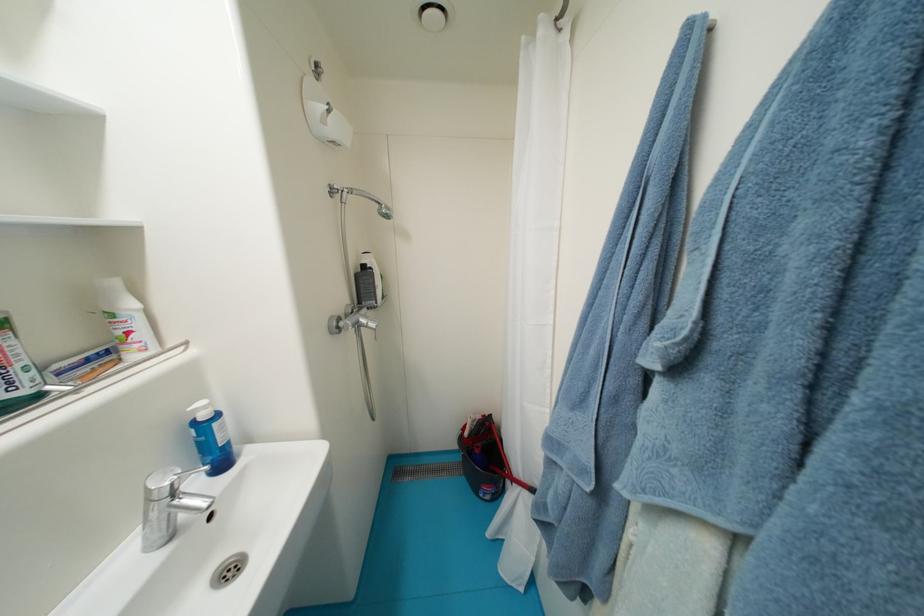
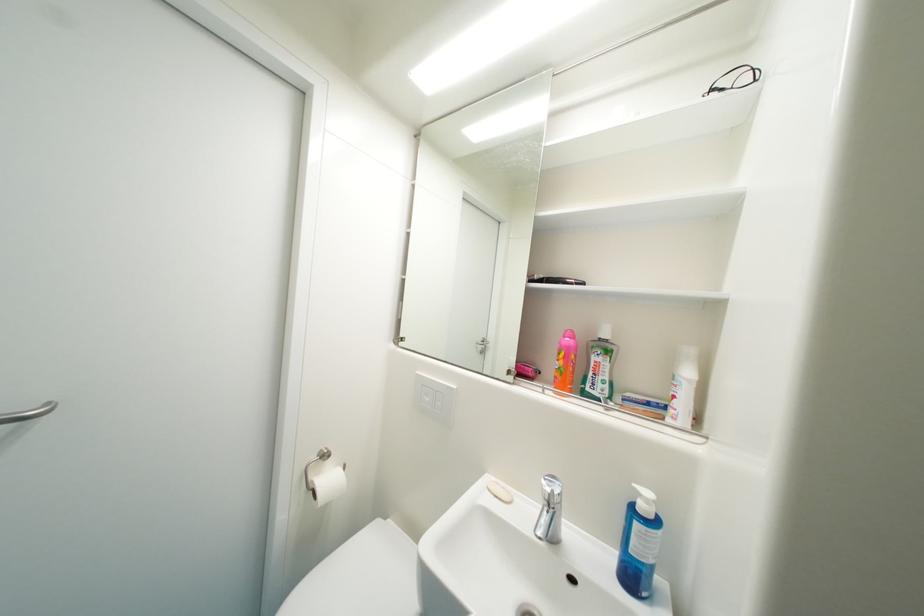
In the second image, find the point that corresponds to point (213, 408) in the first image.

(653, 503)